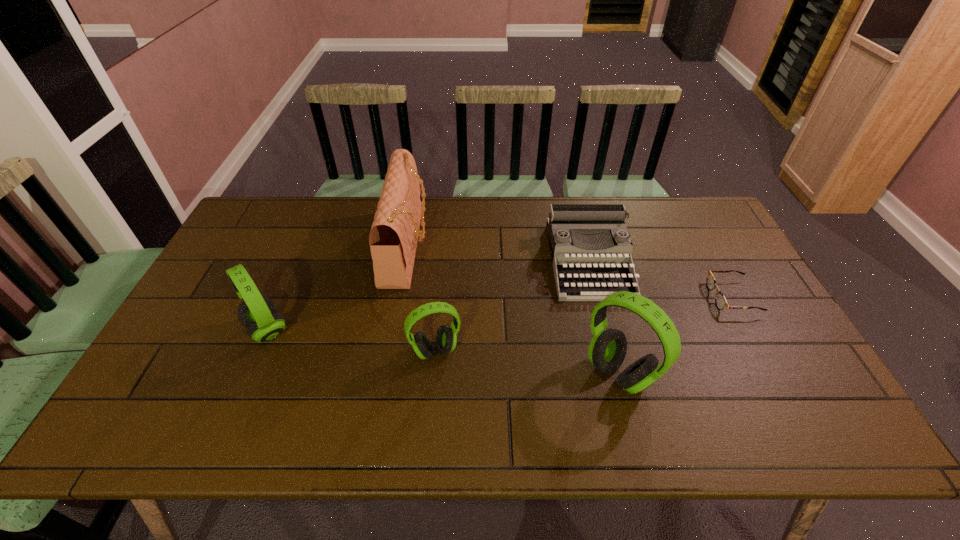
You are a GUI agent. You are given a task and a screenshot of the screen. Output one action in this format:
    pyautogui.click(x=<x>, y=<y>)
    Task: Click on the object at the right edge
    This screenshot has height=540, width=960.
    Given the screenshot: What is the action you would take?
    pyautogui.click(x=720, y=300)

Where is `free space at the far edge of the desktop`? free space at the far edge of the desktop is located at coordinates (540, 238).

Image resolution: width=960 pixels, height=540 pixels. What are the coordinates of `vacant space at the near edge of the desktop` in the screenshot? It's located at (500, 395).

In order to click on free point at the right edge in this screenshot , I will do `click(802, 367)`.

Locate an element on the screen. This screenshot has height=540, width=960. free region at the far left corner is located at coordinates (251, 213).

At what (x,y) coordinates should I click in order to perform the action: click on vacant space at the far right corner of the desktop. Please return your answer as a coordinate pair (x, y). The height and width of the screenshot is (540, 960). Looking at the image, I should click on (696, 221).

At what (x,y) coordinates should I click in order to perform the action: click on vacant space that's between the fourth tallest object and the tallest headset. Please return your answer as a coordinate pair (x, y). This screenshot has width=960, height=540. Looking at the image, I should click on (527, 362).

In order to click on empty space that is in between the shortest object and the second headset from left to right in this screenshot , I will do `click(584, 324)`.

At what (x,y) coordinates should I click in order to perform the action: click on free space between the typewriter and the second headset from left to right. Please return your answer as a coordinate pair (x, y). Looking at the image, I should click on (513, 306).

The height and width of the screenshot is (540, 960). What are the coordinates of `free space between the shortest object and the handbag` in the screenshot? It's located at pyautogui.click(x=569, y=272).